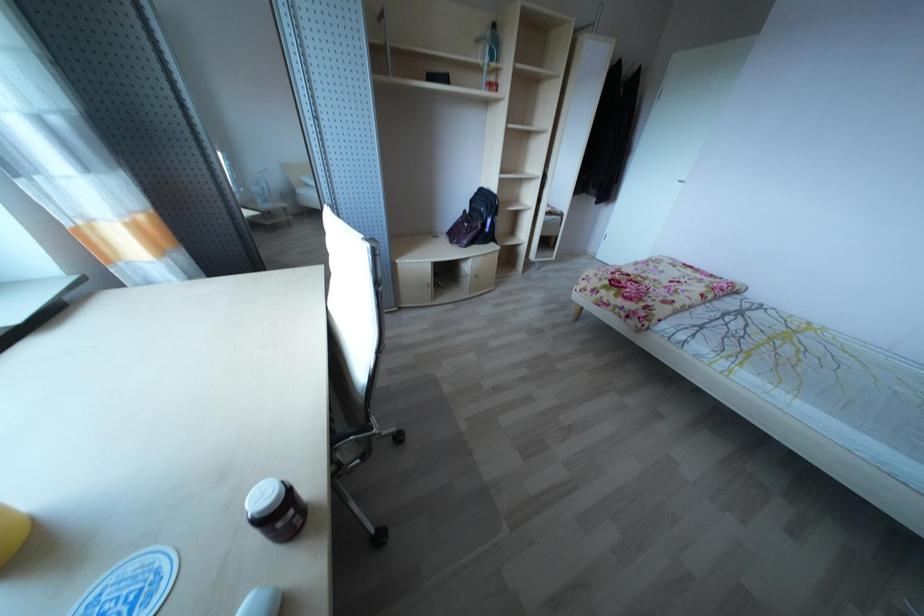
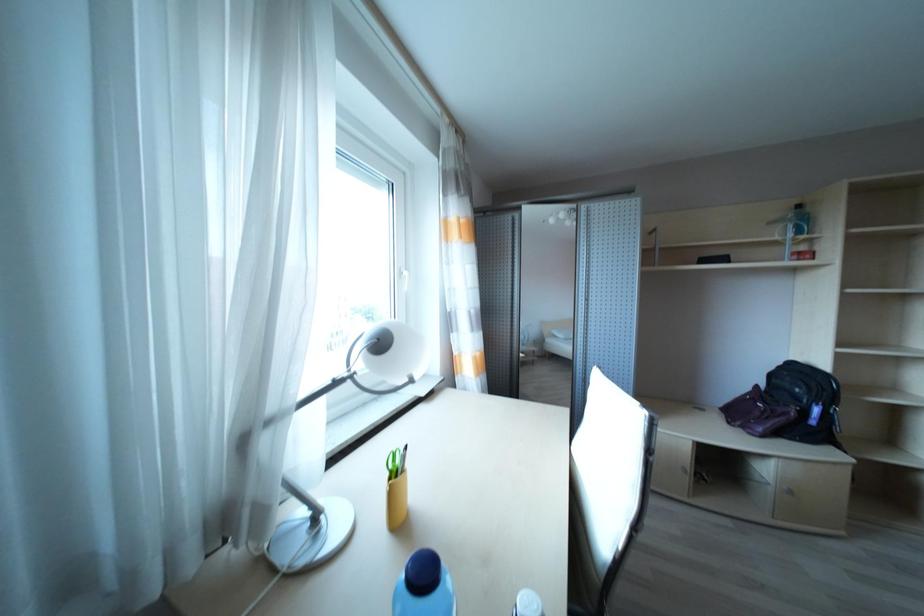
The first image is from the beginning of the video and the second image is from the end. How did the camera likely rotate when shooting the video?

The camera's rotation is toward left-up.